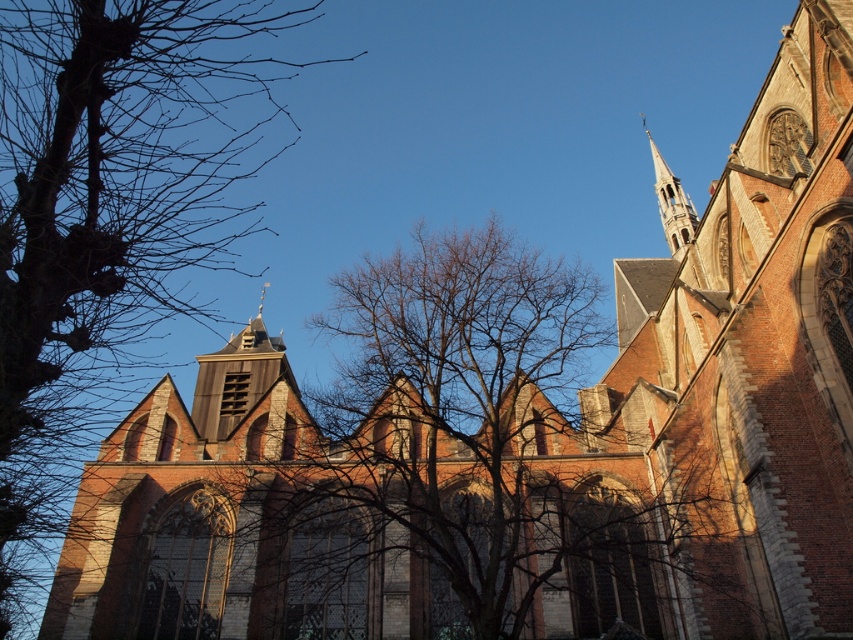
Question: Estimate the real-world distances between objects in this image. Which object is closer to the smooth gray steeple at upper right?

Choices:
 (A) bare branches at left
 (B) bare branches at center

Answer: (B)

Question: In this image, where is bare branches at left located relative to bare branches at center?

Choices:
 (A) right
 (B) left

Answer: (B)

Question: Can you confirm if bare branches at center is smaller than smooth gray steeple at upper right?

Choices:
 (A) no
 (B) yes

Answer: (A)

Question: Can you confirm if bare branches at left is positioned below smooth gray steeple at upper right?

Choices:
 (A) yes
 (B) no

Answer: (A)

Question: Estimate the real-world distances between objects in this image. Which object is closer to the bare branches at left?

Choices:
 (A) bare branches at center
 (B) smooth gray steeple at upper right

Answer: (A)

Question: Which is nearer to the bare branches at center?

Choices:
 (A) smooth gray steeple at upper right
 (B) bare branches at left

Answer: (A)